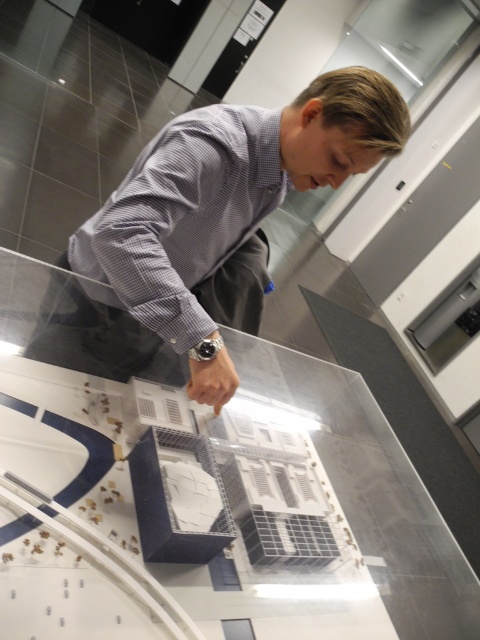
Is gray checkered shirt at upper center to the right of metallic silver watch at center from the viewer's perspective?

Yes, gray checkered shirt at upper center is to the right of metallic silver watch at center.

Is point (337, 99) farther from camera compared to point (189, 356)?

That is True.

At what (x,y) coordinates should I click in order to perform the action: click on gray checkered shirt at upper center. Please return your answer as a coordinate pair (x, y). Looking at the image, I should click on (216, 212).

Between point (424, 620) and point (205, 349), which one is positioned behind?

Positioned behind is point (424, 620).

Who is positioned more to the right, transparent glass table at center or metallic silver watch at center?

From the viewer's perspective, metallic silver watch at center appears more on the right side.

Who is more forward, (166, 451) or (218, 348)?

Point (218, 348) is in front.

Locate an element on the screen. The image size is (480, 640). transparent glass table at center is located at coordinates (222, 497).

Is transparent glass table at center wider than gray checkered dress shirt at center?

Correct, the width of transparent glass table at center exceeds that of gray checkered dress shirt at center.

Is point (336, 602) closer to camera compared to point (205, 252)?

Yes, point (336, 602) is in front of point (205, 252).

At what (x,y) coordinates should I click in order to perform the action: click on transparent glass table at center. Please return your answer as a coordinate pair (x, y). Image resolution: width=480 pixels, height=640 pixels. Looking at the image, I should click on (222, 497).